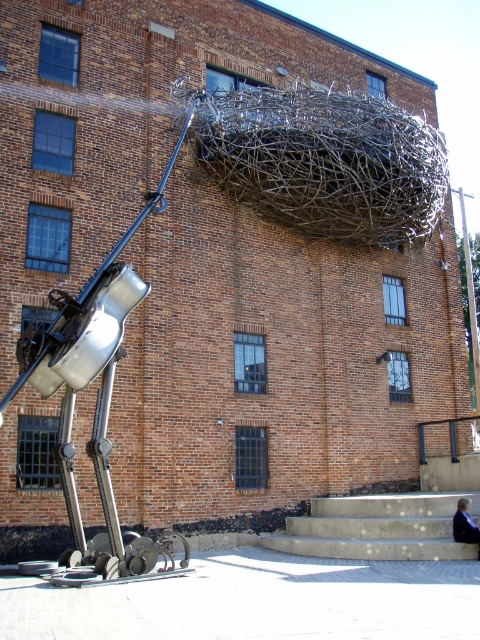
Question: Is concrete stairs at lower right smaller than dark blue fabric jacket at lower right?

Choices:
 (A) yes
 (B) no

Answer: (B)

Question: Is concrete stairs at lower right smaller than dark blue fabric jacket at lower right?

Choices:
 (A) no
 (B) yes

Answer: (A)

Question: Which point is farther to the camera?

Choices:
 (A) (396, 524)
 (B) (459, 538)

Answer: (A)

Question: Is concrete stairs at lower right bigger than dark blue fabric jacket at lower right?

Choices:
 (A) no
 (B) yes

Answer: (B)